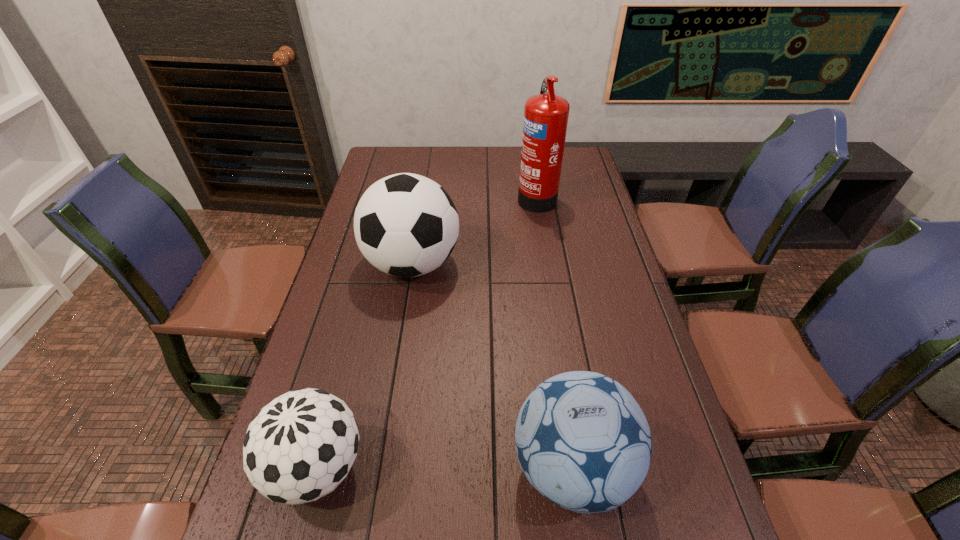
Image resolution: width=960 pixels, height=540 pixels. I want to click on empty location between the tallest object and the second tallest soccer ball, so click(554, 332).

You are a GUI agent. You are given a task and a screenshot of the screen. Output one action in this format:
    pyautogui.click(x=<x>, y=<y>)
    Task: Click on the free area in between the second tallest object and the farthest object
    Image resolution: width=960 pixels, height=540 pixels.
    Given the screenshot: What is the action you would take?
    pyautogui.click(x=474, y=230)

Image resolution: width=960 pixels, height=540 pixels. In order to click on free space that is in between the rightmost soccer ball and the fire extinguisher in this screenshot , I will do `click(554, 332)`.

Image resolution: width=960 pixels, height=540 pixels. I want to click on free space between the tallest soccer ball and the farthest object, so click(x=474, y=230).

Locate an element on the screen. vacant space in between the second tallest soccer ball and the shortest object is located at coordinates (444, 467).

Where is `vacant space that is in between the second shortest soccer ball and the tallest soccer ball`? The height and width of the screenshot is (540, 960). vacant space that is in between the second shortest soccer ball and the tallest soccer ball is located at coordinates (492, 366).

The height and width of the screenshot is (540, 960). What are the coordinates of `empty space that is in between the second shortest soccer ball and the shortest object` in the screenshot? It's located at (444, 467).

Find the location of a particular element. free space that is in between the third nearest object and the fire extinguisher is located at coordinates [x=474, y=230].

At what (x,y) coordinates should I click in order to perform the action: click on empty space between the farthest soccer ball and the shortest object. Please return your answer as a coordinate pair (x, y). Looking at the image, I should click on (365, 366).

Image resolution: width=960 pixels, height=540 pixels. What are the coordinates of `empty space between the fire extinguisher and the third shortest object` in the screenshot? It's located at (474, 230).